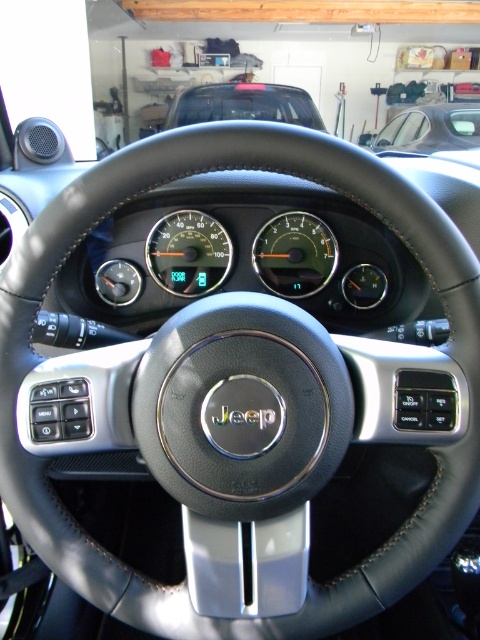
Can you confirm if matte black gauge at center is shorter than metallic silver car at upper right?

Yes.

Can you confirm if matte black gauge at center is wider than metallic silver car at upper right?

In fact, matte black gauge at center might be narrower than metallic silver car at upper right.

Is point (262, 236) closer to camera compared to point (457, 118)?

Yes.

Image resolution: width=480 pixels, height=640 pixels. Identify the location of matte black gauge at center. (295, 253).

Is matte black speedometer at center behind matte black car at upper center?

No, it is not.

Can you confirm if matte black speedometer at center is thinner than matte black car at upper center?

Indeed, matte black speedometer at center has a lesser width compared to matte black car at upper center.

Who is more forward, (204, 269) or (211, 100)?

Point (204, 269) is more forward.

You are a GUI agent. You are given a task and a screenshot of the screen. Output one action in this format:
    pyautogui.click(x=<x>, y=<y>)
    Task: Click on the matte black speedometer at center
    This screenshot has width=480, height=640.
    Given the screenshot: What is the action you would take?
    pyautogui.click(x=189, y=252)

Can you confirm if matte black gauge at center is bigger than matte black car at upper center?

No, matte black gauge at center is not bigger than matte black car at upper center.

From the picture: Is matte black gauge at center thinner than matte black car at upper center?

Yes, matte black gauge at center is thinner than matte black car at upper center.

Identify the location of matte black gauge at center. The image size is (480, 640). (295, 253).